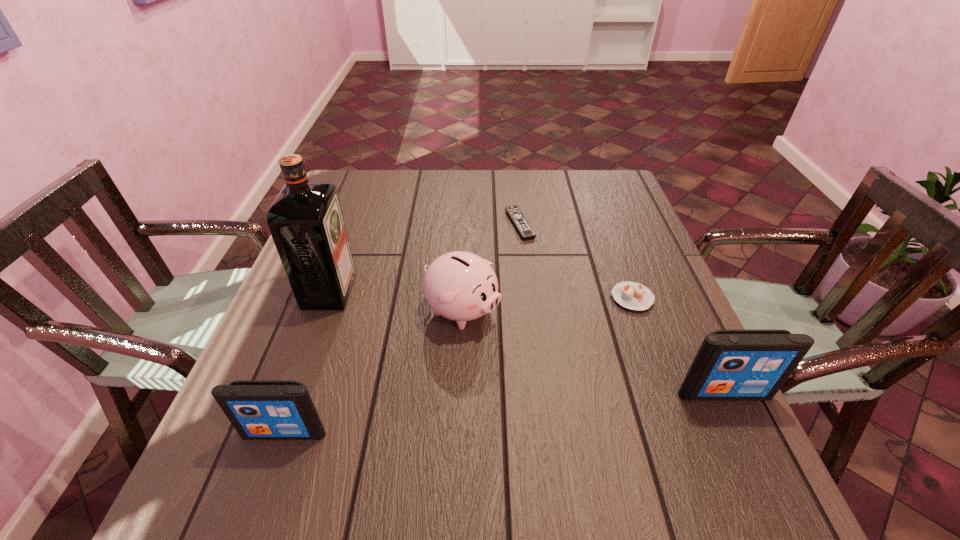
Locate an element on the screen. The height and width of the screenshot is (540, 960). blank region between the piggy bank and the cupcake is located at coordinates (547, 305).

Find the location of a particular element. unoccupied position between the second shortest object and the fourth object from left to right is located at coordinates pos(576,261).

Where is `vacant point located between the nearer iPod and the liquor`? The image size is (960, 540). vacant point located between the nearer iPod and the liquor is located at coordinates (307, 362).

Point out which object is positioned as the nearest to the fourth object from right to left. Please provide its 2D coordinates. Your answer should be formatted as a tuple, i.e. [(x, y)], where the tuple contains the x and y coordinates of a point satisfying the conditions above.

[(306, 221)]

Select which object is the third closest to the liquor. Please provide its 2D coordinates. Your answer should be formatted as a tuple, i.e. [(x, y)], where the tuple contains the x and y coordinates of a point satisfying the conditions above.

[(522, 225)]

Locate an element on the screen. This screenshot has height=540, width=960. free space that satisfies the following two spatial constraints: 1. on the front label of the liquor; 2. on the left side of the fifth tallest object is located at coordinates (327, 298).

Identify the location of free space that satisfies the following two spatial constraints: 1. on the back side of the second shortest object; 2. on the front label of the tallest object. This screenshot has height=540, width=960. (630, 291).

Where is `free space that satisfies the following two spatial constraints: 1. on the front side of the third object from right to left; 2. on the front label of the liquor`? free space that satisfies the following two spatial constraints: 1. on the front side of the third object from right to left; 2. on the front label of the liquor is located at coordinates tap(527, 291).